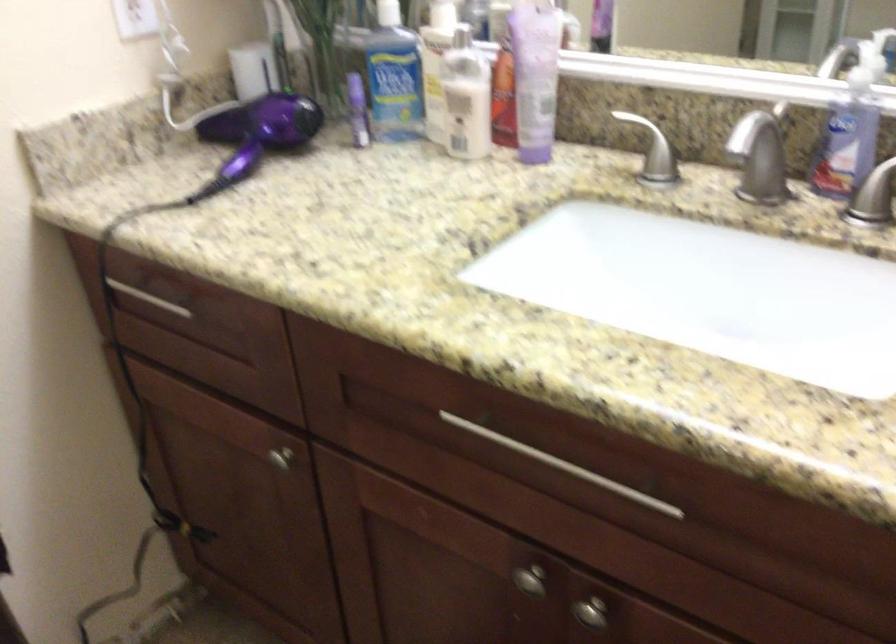
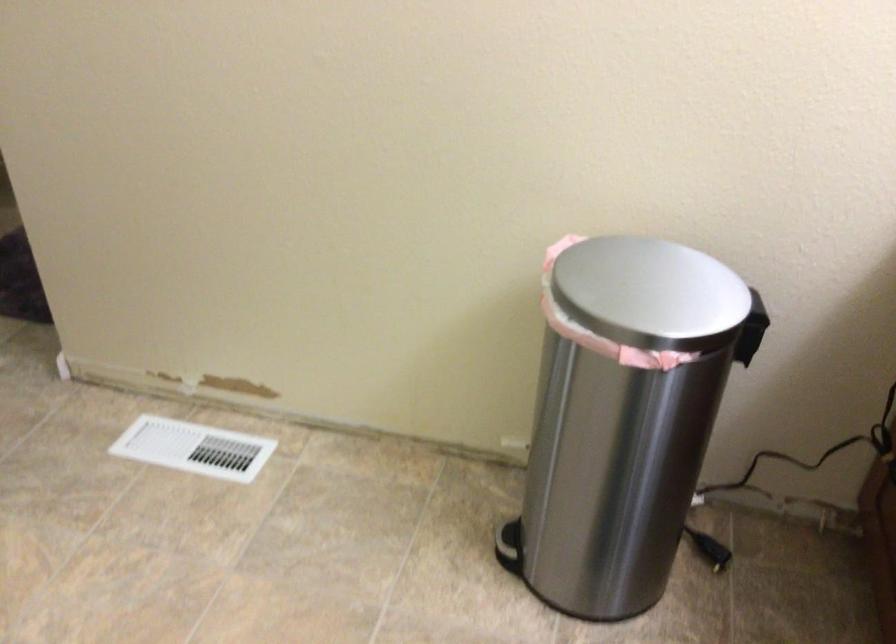
Based on the continuous images, in which direction is the camera rotating?

The camera's rotation is toward left-down.